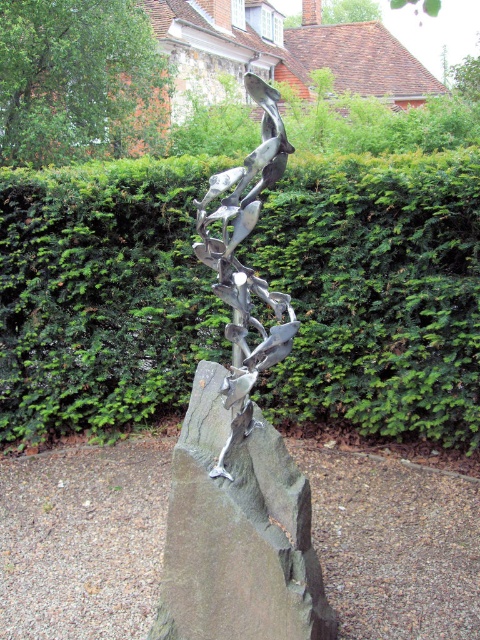
This screenshot has height=640, width=480. What do you see at coordinates (376, 292) in the screenshot?
I see `green leafy hedge at center` at bounding box center [376, 292].

Does green leafy hedge at center appear under polished gray rock at center?

Incorrect, green leafy hedge at center is not positioned below polished gray rock at center.

At what (x,y) coordinates should I click in order to perform the action: click on green leafy hedge at center. Please return your answer as a coordinate pair (x, y). This screenshot has height=640, width=480. Looking at the image, I should click on (376, 292).

This screenshot has height=640, width=480. I want to click on green leafy hedge at center, so click(x=376, y=292).

Is green leafy hedge at center smaller than polished bronze sculpture at center?

Actually, green leafy hedge at center might be larger than polished bronze sculpture at center.

Does green leafy hedge at center have a greater height compared to polished bronze sculpture at center?

Indeed, green leafy hedge at center has a greater height compared to polished bronze sculpture at center.

Is point (137, 204) closer to camera compared to point (264, 150)?

No.

This screenshot has height=640, width=480. In order to click on green leafy hedge at center in this screenshot , I will do (376, 292).

Measure the distance between polished gray rock at center and camera.

polished gray rock at center and camera are 7.89 feet apart from each other.

Consider the image. Who is taller, polished gray rock at center or polished bronze sculpture at center?

polished bronze sculpture at center

The width and height of the screenshot is (480, 640). Identify the location of polished gray rock at center. (238, 534).